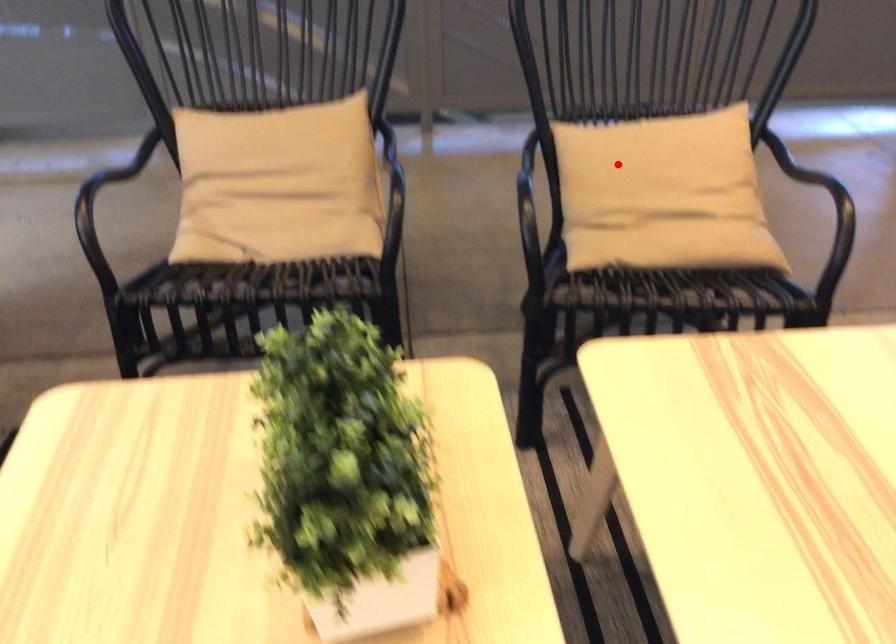
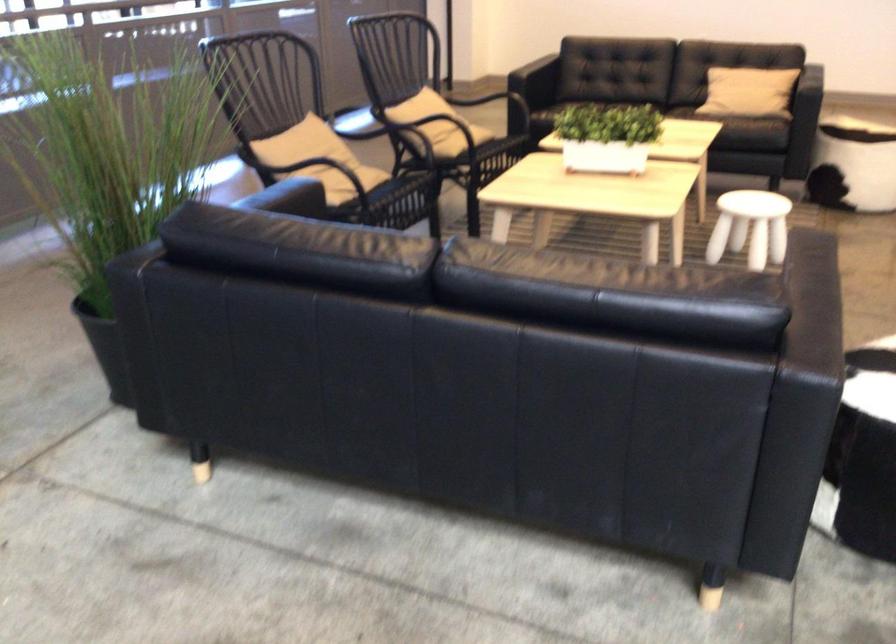
The point at the highlighted location is marked in the first image. Where is the corresponding point in the second image?

(431, 111)